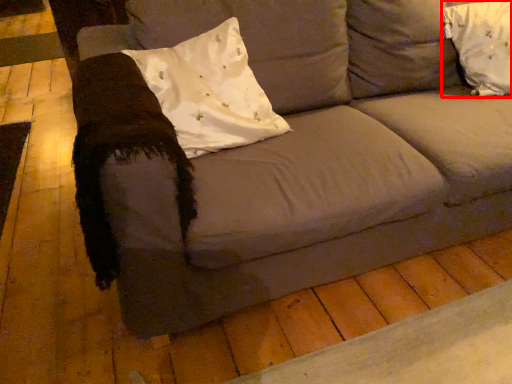
Question: From the image, what is the correct spatial relationship of pillow (annotated by the red box) in relation to pillow?

Choices:
 (A) right
 (B) left

Answer: (A)